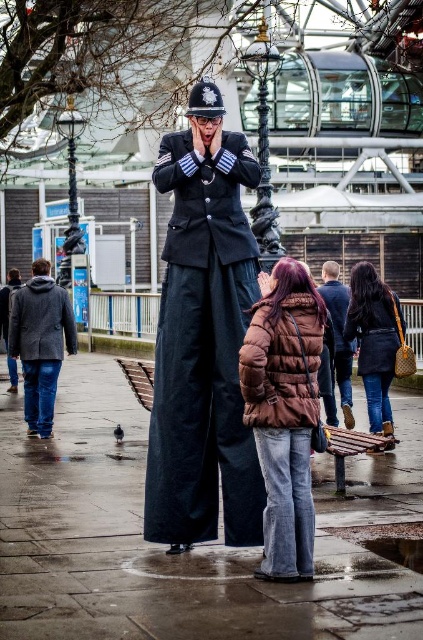
Question: Does gray woolen coat at left come in front of dark gray woolen coat at left?

Choices:
 (A) yes
 (B) no

Answer: (A)

Question: Which point is farther to the camera?

Choices:
 (A) brown puffy jacket at lower center
 (B) matte black uniform at center
 (C) brown puffy coat at center
 (D) smooth concrete pavement at center

Answer: (C)

Question: Can you confirm if gray woolen coat at left is smaller than leather jacket at lower right?

Choices:
 (A) no
 (B) yes

Answer: (A)

Question: Considering the real-world distances, which object is closest to the leather jacket at lower right?

Choices:
 (A) smooth concrete pavement at center
 (B) brown puffy coat at center
 (C) matte black uniform at center

Answer: (B)

Question: Is smooth concrete pavement at center smaller than gray woolen coat at left?

Choices:
 (A) no
 (B) yes

Answer: (A)

Question: Based on their relative distances, which object is nearer to the brown puffy jacket at lower center?

Choices:
 (A) gray woolen coat at left
 (B) smooth concrete pavement at center
 (C) brown puffy coat at center

Answer: (B)